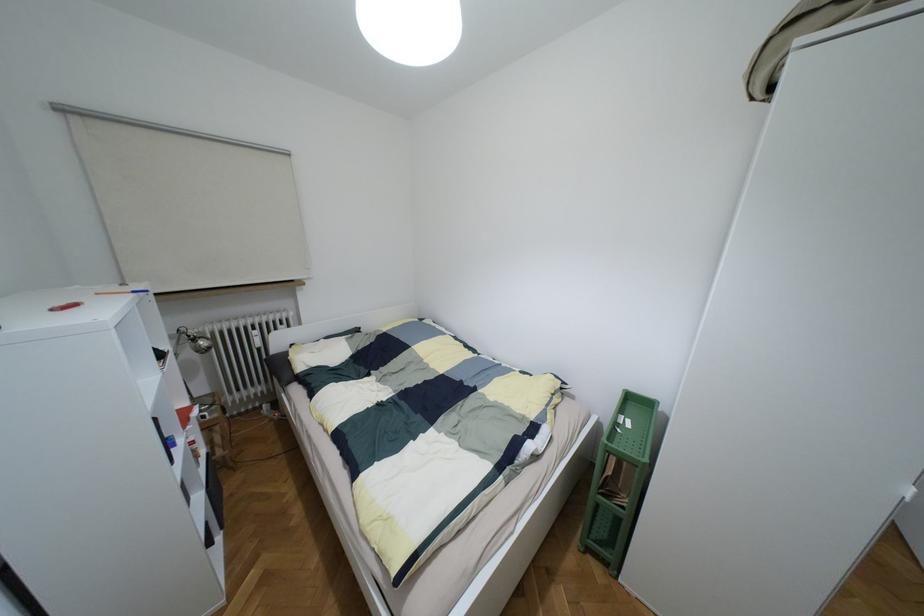
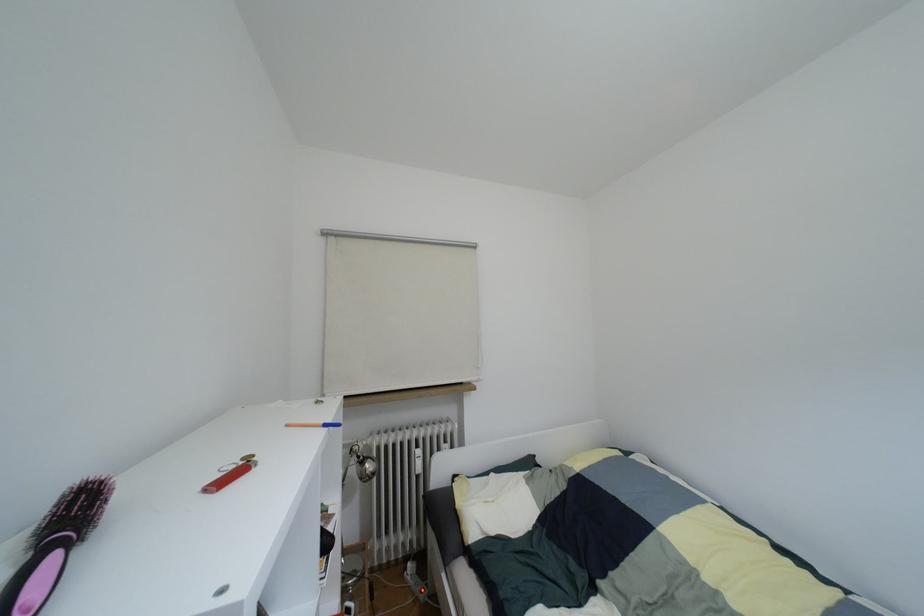
Based on the continuous images, in which direction is the camera rotating?

The camera rotated toward left-up.